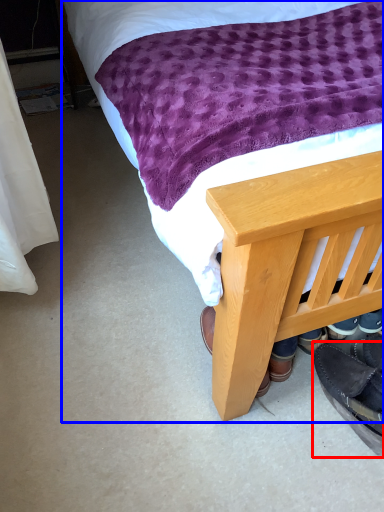
Question: Which point is further to the camera, footwear (highlighted by a red box) or bed (highlighted by a blue box)?

Choices:
 (A) footwear
 (B) bed

Answer: (A)